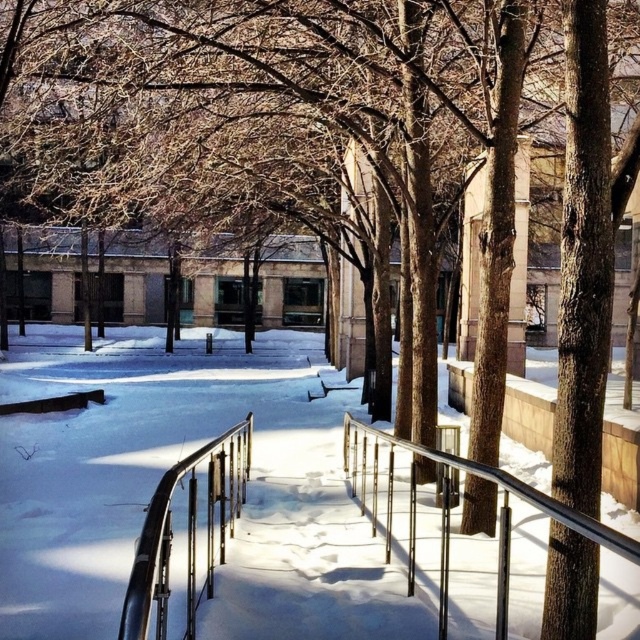
Question: Which object is positioned farthest from the white powdery snow at center?

Choices:
 (A) black metal railing at center
 (B) metallic silver railing at center

Answer: (A)

Question: From the image, what is the correct spatial relationship of black metal railing at center in relation to metallic silver railing at center?

Choices:
 (A) left
 (B) right

Answer: (A)

Question: Does black metal railing at center have a larger size compared to metallic silver railing at center?

Choices:
 (A) no
 (B) yes

Answer: (B)

Question: Estimate the real-world distances between objects in this image. Which object is farther from the black metal railing at center?

Choices:
 (A) white powdery snow at center
 (B) metallic silver railing at center

Answer: (A)

Question: Among these points, which one is nearest to the camera?

Choices:
 (A) (172, 506)
 (B) (362, 508)
 (C) (22, 520)

Answer: (A)

Question: Is white powdery snow at center to the left of metallic silver railing at center from the viewer's perspective?

Choices:
 (A) no
 (B) yes

Answer: (B)